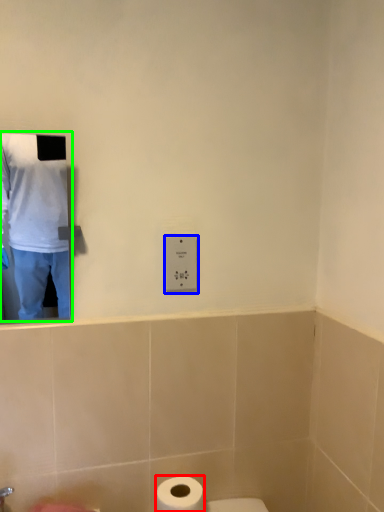
Question: Which object is the farthest from toilet paper (highlighted by a red box)? Choose among these: electric outlet (highlighted by a blue box) or man (highlighted by a green box).

Choices:
 (A) electric outlet
 (B) man

Answer: (B)